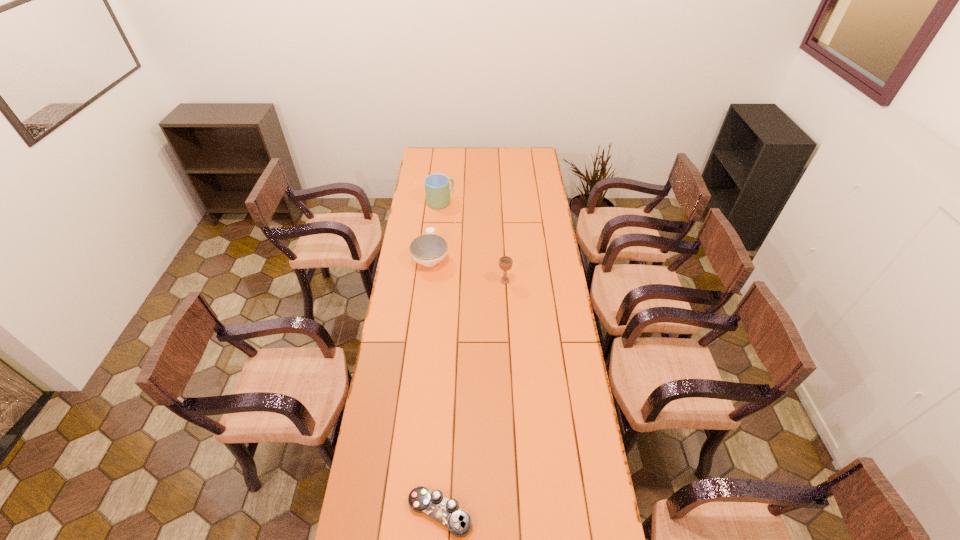
The width and height of the screenshot is (960, 540). What are the coordinates of `object that ranks as the second closest to the shortest object` in the screenshot? It's located at coord(429,249).

Locate which object ranks in proximity to the nearest object. Please provide its 2D coordinates. Your answer should be formatted as a tuple, i.e. [(x, y)], where the tuple contains the x and y coordinates of a point satisfying the conditions above.

[(505, 262)]

Find the location of `vacant space that satisfies the following two spatial constraints: 1. on the side with the handle of the chinaware; 2. on the left side of the mug`. vacant space that satisfies the following two spatial constraints: 1. on the side with the handle of the chinaware; 2. on the left side of the mug is located at coordinates (437, 202).

Where is `free location that satisfies the following two spatial constraints: 1. on the side with the handle of the farthest object; 2. on the left side of the third nearest object`? The width and height of the screenshot is (960, 540). free location that satisfies the following two spatial constraints: 1. on the side with the handle of the farthest object; 2. on the left side of the third nearest object is located at coordinates (437, 202).